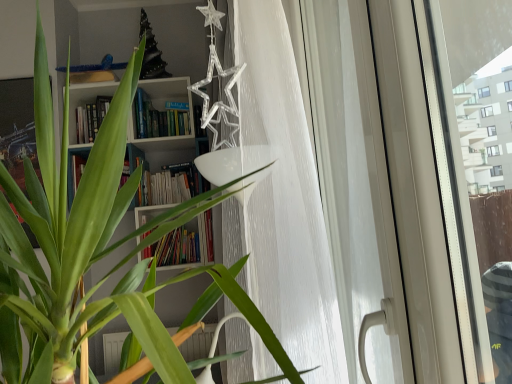
Question: From the image's perspective, is white textured curtain at center over white glossy screen door at right?

Choices:
 (A) no
 (B) yes

Answer: (B)

Question: Could you tell me if white textured curtain at center is facing white glossy screen door at right?

Choices:
 (A) no
 (B) yes

Answer: (B)

Question: Can you confirm if white textured curtain at center is taller than white glossy screen door at right?

Choices:
 (A) no
 (B) yes

Answer: (B)

Question: Does white textured curtain at center have a lesser height compared to white glossy screen door at right?

Choices:
 (A) no
 (B) yes

Answer: (A)

Question: From the image's perspective, does white textured curtain at center appear lower than white glossy screen door at right?

Choices:
 (A) yes
 (B) no

Answer: (B)

Question: Does white textured curtain at center have a greater width compared to white glossy screen door at right?

Choices:
 (A) yes
 (B) no

Answer: (A)

Question: Is white glossy screen door at right bigger than white textured curtain at center?

Choices:
 (A) no
 (B) yes

Answer: (A)

Question: Does white glossy screen door at right have a greater height compared to white textured curtain at center?

Choices:
 (A) no
 (B) yes

Answer: (A)

Question: From the image's perspective, is white glossy screen door at right above white textured curtain at center?

Choices:
 (A) yes
 (B) no

Answer: (B)

Question: Is white glossy screen door at right placed right next to white textured curtain at center?

Choices:
 (A) no
 (B) yes

Answer: (A)

Question: Is white textured curtain at center at the back of white glossy screen door at right?

Choices:
 (A) no
 (B) yes

Answer: (B)

Question: Is white glossy screen door at right thinner than white textured curtain at center?

Choices:
 (A) no
 (B) yes

Answer: (B)

Question: From the image's perspective, is white textured curtain at center above or below white glossy screen door at right?

Choices:
 (A) below
 (B) above

Answer: (B)